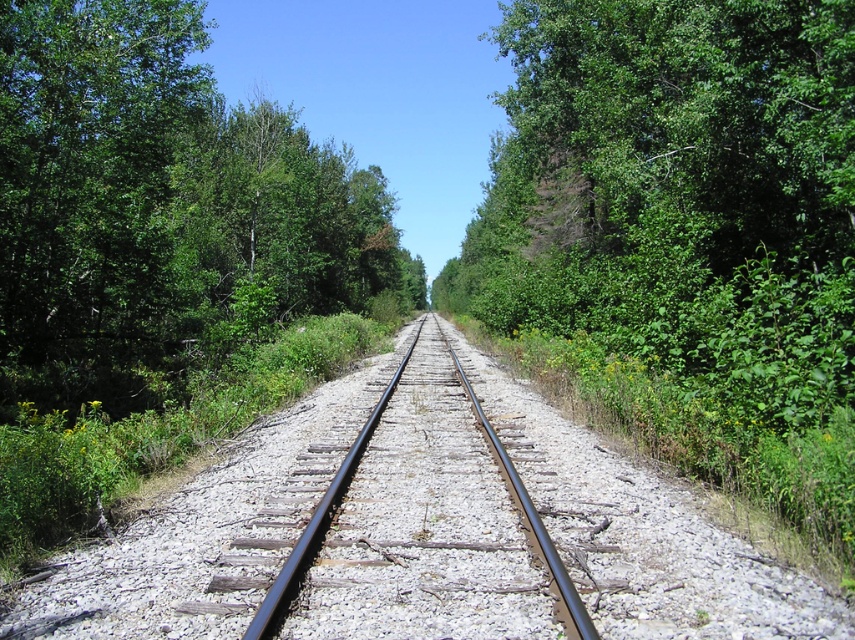
Can you confirm if green leafy tree at center is shorter than black metal train track at center?

In fact, green leafy tree at center may be taller than black metal train track at center.

Is green leafy tree at center closer to camera compared to black metal train track at center?

No, green leafy tree at center is behind black metal train track at center.

Who is more distant from viewer, (219,163) or (404,408)?

The point (219,163) is more distant.

This screenshot has height=640, width=855. I want to click on green leafy tree at center, so click(x=158, y=208).